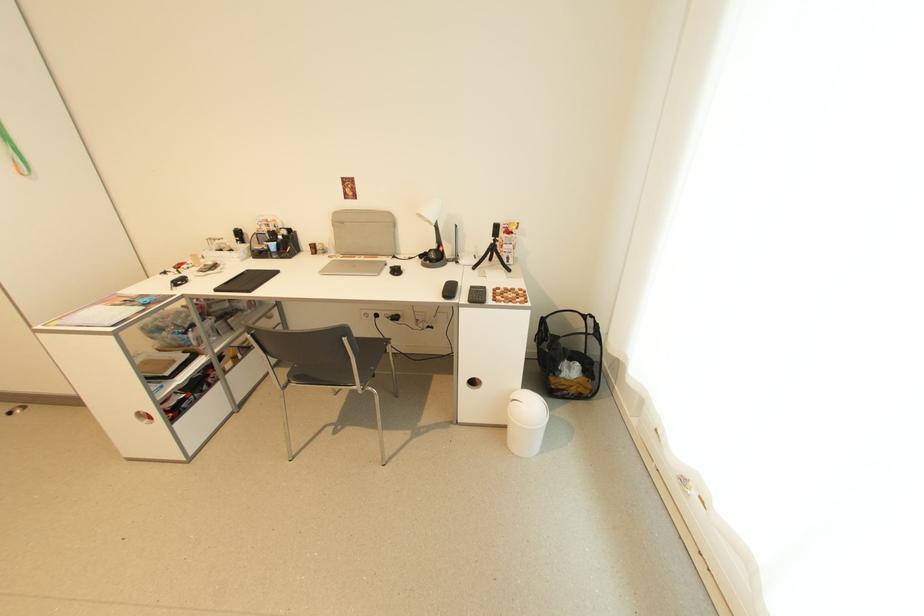
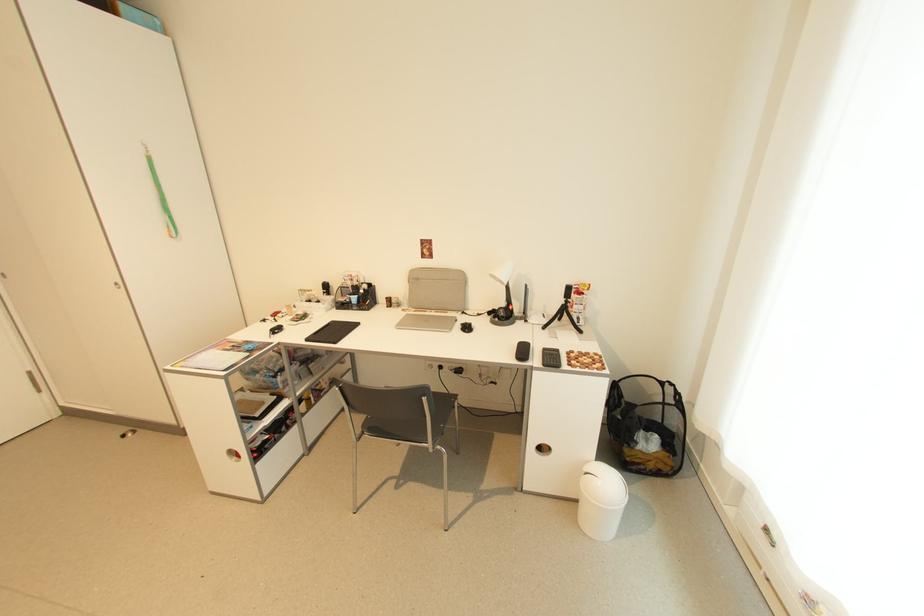
The point at (512, 446) is marked in the first image. Where is the corresponding point in the second image?

(581, 524)